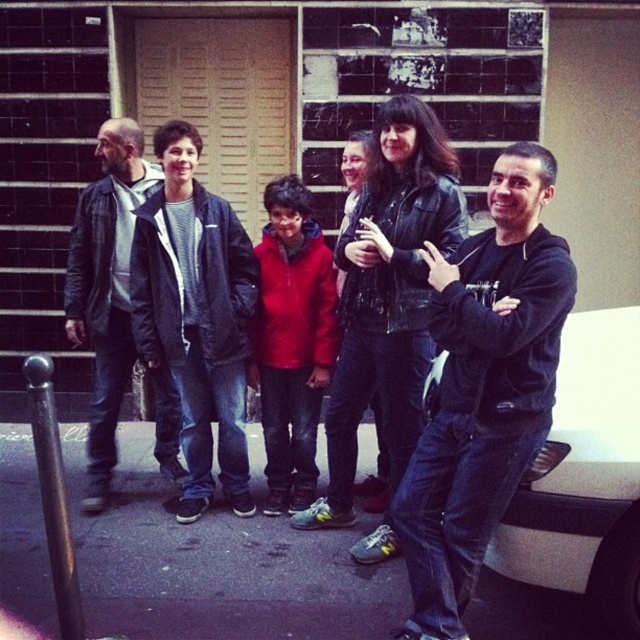
Which is behind, point (545, 262) or point (161, 355)?

The point (161, 355) is behind.

Can you confirm if black matte jacket at center is positioned above dark blue jacket at center?

No, black matte jacket at center is not above dark blue jacket at center.

Is point (563, 253) farther from viewer compared to point (208, 483)?

No, it is not.

Locate an element on the screen. The width and height of the screenshot is (640, 640). black matte jacket at center is located at coordinates (483, 388).

Can you confirm if black matte car at right is thinner than leather jacket at left?

No.

Which is in front, point (632, 588) or point (141, 196)?

Positioned in front is point (632, 588).

Find the location of a particular element. This screenshot has height=640, width=640. black matte car at right is located at coordinates (584, 477).

The height and width of the screenshot is (640, 640). Find the location of `black matte car at right`. black matte car at right is located at coordinates (584, 477).

Does dark blue jacket at center lie in front of leather jacket at left?

That is True.

Does dark blue jacket at center come behind leather jacket at left?

No, dark blue jacket at center is closer to the viewer.

Where is `dark blue jacket at center`? This screenshot has height=640, width=640. dark blue jacket at center is located at coordinates (195, 316).